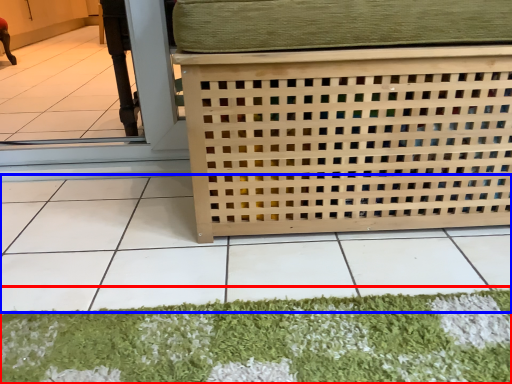
Question: Which object is further to the camera taking this photo, mat (highlighted by a red box) or tile (highlighted by a blue box)?

Choices:
 (A) mat
 (B) tile

Answer: (A)